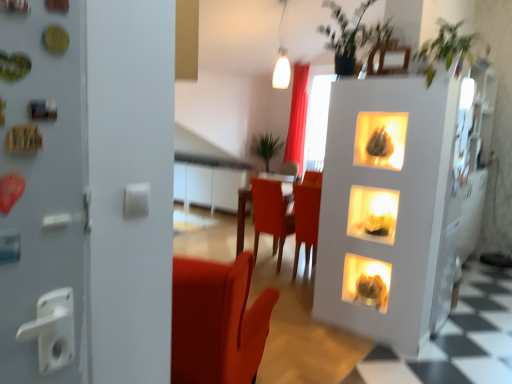
Question: Looking at their shapes, would you say green leafy plant at upper center, which ranks as the 2th plant in front-to-back order, is wider or thinner than red velvet curtain at upper center?

Choices:
 (A) wide
 (B) thin

Answer: (A)

Question: From the image's perspective, is green leafy plant at upper center, which ranks as the 2th plant in front-to-back order, above or below red velvet curtain at upper center?

Choices:
 (A) above
 (B) below

Answer: (A)

Question: Estimate the real-world distances between objects in this image. Which object is closer to the matte brown fireplace at lower right, marked as the second fireplace in a top-to-bottom arrangement?

Choices:
 (A) green leafy plant at upper right, which appears as the 3th plant when viewed from the back
 (B) wooden table at center
 (C) red velvet curtain at upper center
 (D) green leafy plant at upper center, marked as the second plant in a left-to-right arrangement
 (E) matte yellow stone at center, which is the 1th fireplace in top-to-bottom order

Answer: (E)

Question: Which of these objects is positioned closest to the green leafy plant at center, marked as the first plant in a left-to-right arrangement?

Choices:
 (A) green leafy plant at upper right, the first plant viewed from the right
 (B) wooden table at center
 (C) green leafy plant at upper center, which ranks as the 2th plant in front-to-back order
 (D) matte yellow stone at center, which is the 1th fireplace in top-to-bottom order
 (E) red velvet curtain at upper center

Answer: (E)